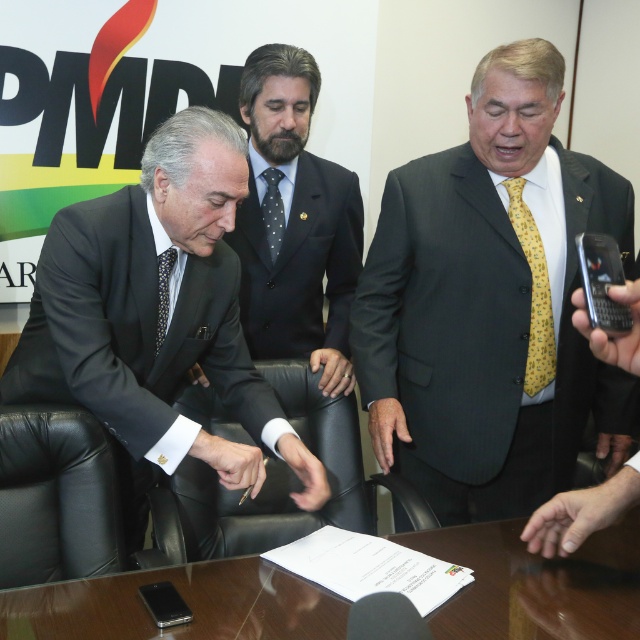
The image size is (640, 640). Find the location of `yellow printed tie at center`. yellow printed tie at center is located at coordinates (532, 292).

Is yellow printed tie at center smaller than dotted fabric tie at center?

No.

Where is `yellow printed tie at center`? The image size is (640, 640). yellow printed tie at center is located at coordinates (532, 292).

Does yellow textured tie at center appear on the right side of matte black suit at left?

Yes, yellow textured tie at center is to the right of matte black suit at left.

Based on the photo, which is more to the right, yellow textured tie at center or matte black suit at left?

Positioned to the right is yellow textured tie at center.

Describe the element at coordinates (490, 305) in the screenshot. I see `yellow textured tie at center` at that location.

You are a GUI agent. You are given a task and a screenshot of the screen. Output one action in this format:
    pyautogui.click(x=<x>, y=<y>)
    Task: Click on the yellow textured tie at center
    This screenshot has width=640, height=640.
    Given the screenshot: What is the action you would take?
    pyautogui.click(x=490, y=305)

Which is in front, point (273, 288) or point (531, 291)?

Positioned in front is point (531, 291).

From the picture: Does dark blue suit at center appear on the left side of yellow printed tie at center?

Indeed, dark blue suit at center is positioned on the left side of yellow printed tie at center.

Locate an element on the screen. dark blue suit at center is located at coordinates (294, 224).

Find the location of a particular element. The width and height of the screenshot is (640, 640). dark blue suit at center is located at coordinates (294, 224).